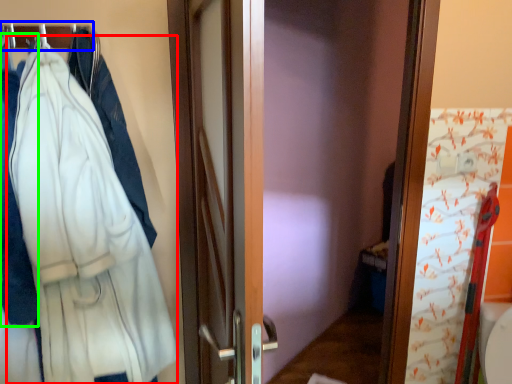
Question: Based on their relative distances, which object is farther from bathrobe (highlighted by a red box)? Choose from hanger (highlighted by a blue box) and garment (highlighted by a green box).

Choices:
 (A) hanger
 (B) garment

Answer: (A)